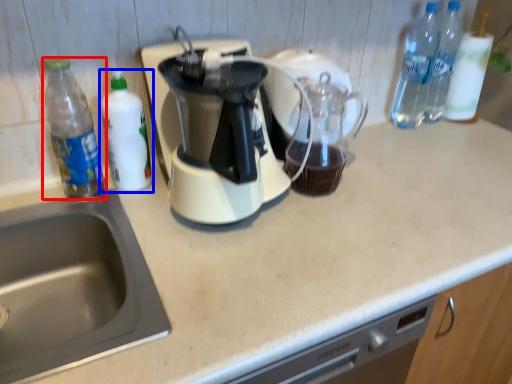
Question: Which of the following is the farthest to the observer, bottle (highlighted by a red box) or bottle (highlighted by a blue box)?

Choices:
 (A) bottle
 (B) bottle

Answer: (B)